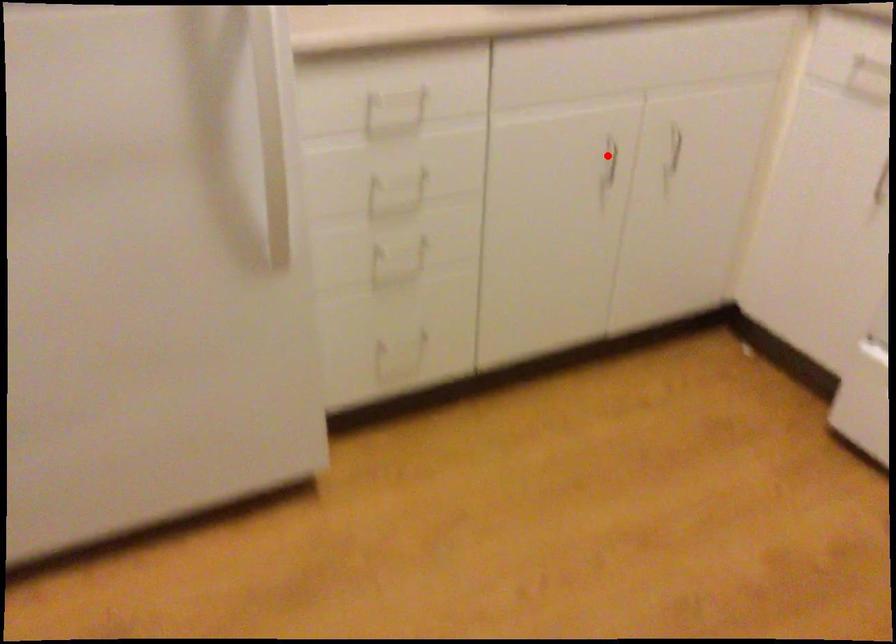
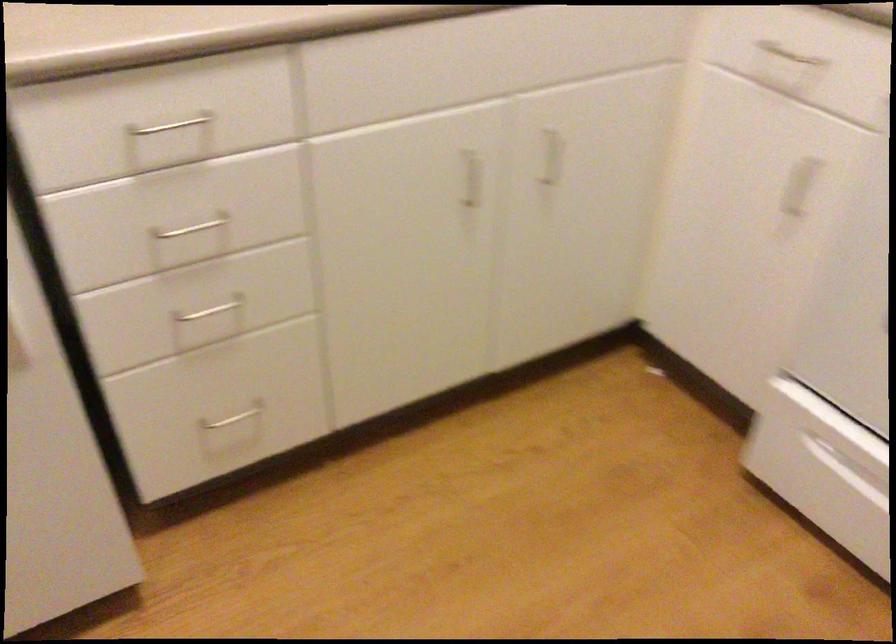
Locate, in the second image, the point that corresponds to the highlighted location in the first image.

(471, 178)